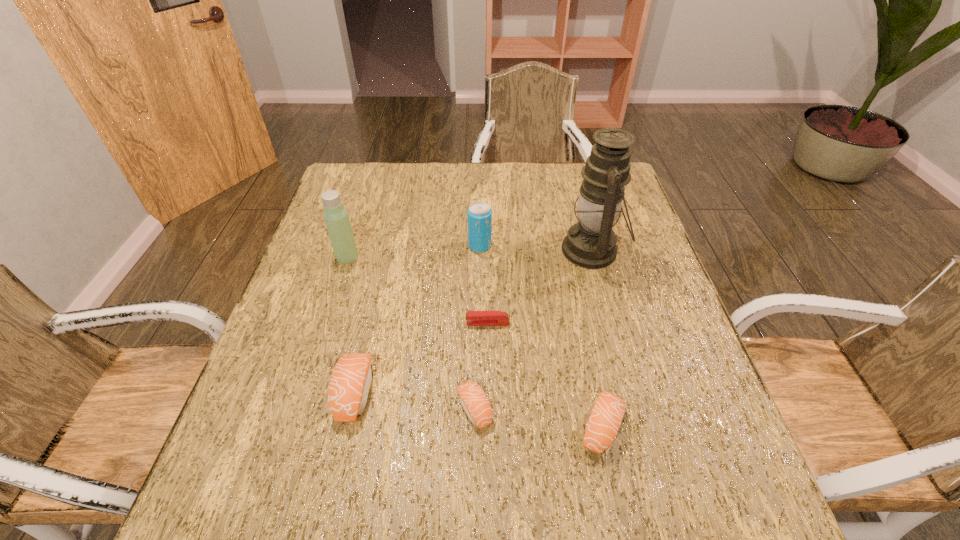
Observe the arrangement of all sushis in the image. To keep them evenly spaced, where would you place another sushi on the right? Please locate a free space. Please provide its 2D coordinates. Your answer should be formatted as a tuple, i.e. [(x, y)], where the tuple contains the x and y coordinates of a point satisfying the conditions above.

[(735, 445)]